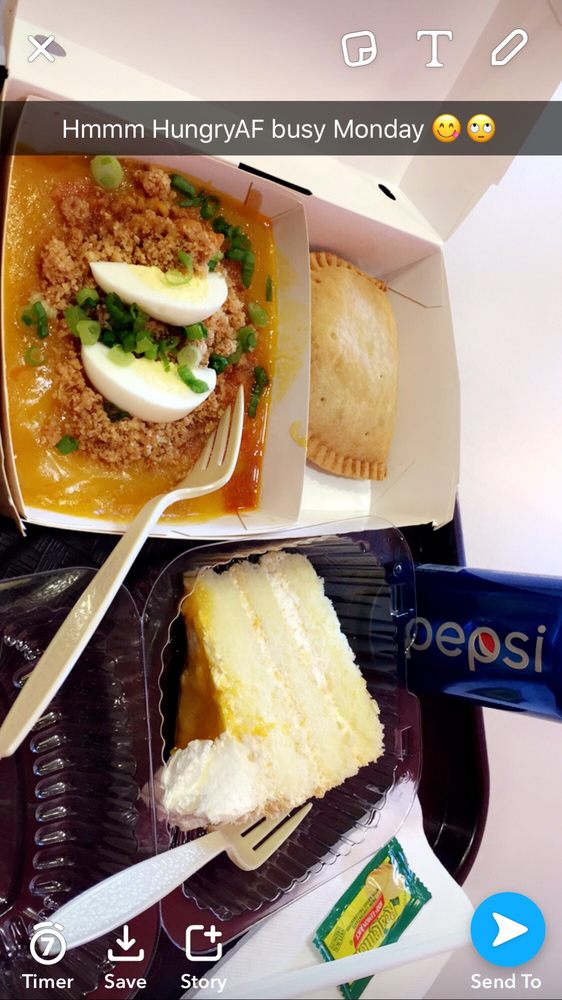
The width and height of the screenshot is (562, 1000). Identify the location of napkin. (273, 935).